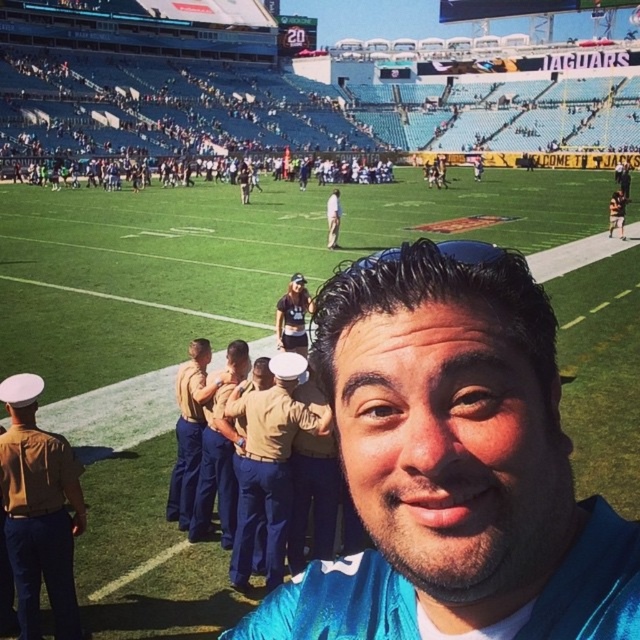
You are standing at the edge of the football field and see two points marked in the image. Which point is closer to you, point 1 at coordinates point (179,509) or point 2 at coordinates point (330,193)?

Point 1 at coordinates point (179,509) is closer to you than point 2 at coordinates point (330,193).

Based on the photo, you are a photographer at the stadium and want to capture a photo of the khaki uniform at center and the khaki uniform pants at center. Which one is positioned lower in the image?

The khaki uniform at center is located below khaki uniform pants at center, so the khaki uniform at center is positioned lower in the image.